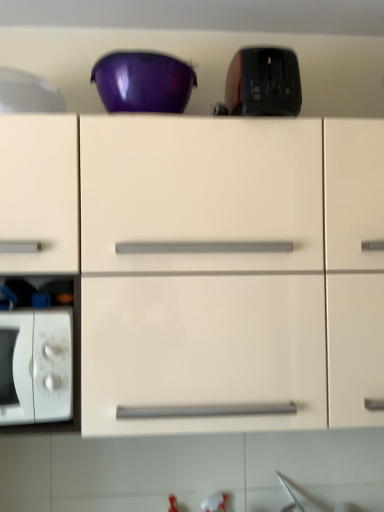
Question: Is glossy plastic bowl at upper center in contact with white matte microwave oven at lower left?

Choices:
 (A) yes
 (B) no

Answer: (B)

Question: From a real-world perspective, does glossy plastic bowl at upper center sit lower than white matte microwave oven at lower left?

Choices:
 (A) no
 (B) yes

Answer: (A)

Question: Does glossy plastic bowl at upper center contain white matte microwave oven at lower left?

Choices:
 (A) no
 (B) yes

Answer: (A)

Question: Can we say glossy plastic bowl at upper center lies outside white matte microwave oven at lower left?

Choices:
 (A) no
 (B) yes

Answer: (B)

Question: Does glossy plastic bowl at upper center appear on the right side of white matte microwave oven at lower left?

Choices:
 (A) no
 (B) yes

Answer: (B)

Question: Are glossy plastic bowl at upper center and white matte microwave oven at lower left far apart?

Choices:
 (A) no
 (B) yes

Answer: (A)

Question: Is white glossy microwave at left, which is the 2th appliance from right to left, facing towards white matte microwave oven at lower left?

Choices:
 (A) no
 (B) yes

Answer: (A)

Question: Is white glossy microwave at left, marked as the first appliance in a left-to-right arrangement, thinner than white matte microwave oven at lower left?

Choices:
 (A) yes
 (B) no

Answer: (A)

Question: Does white glossy microwave at left, marked as the first appliance in a left-to-right arrangement, come in front of white matte microwave oven at lower left?

Choices:
 (A) yes
 (B) no

Answer: (B)

Question: Can you see white glossy microwave at left, which is the 2th appliance from right to left, touching white matte microwave oven at lower left?

Choices:
 (A) no
 (B) yes

Answer: (A)

Question: Is white glossy microwave at left, marked as the first appliance in a left-to-right arrangement, wider than white matte microwave oven at lower left?

Choices:
 (A) yes
 (B) no

Answer: (B)

Question: From the image's perspective, is white glossy microwave at left, which is the 2th appliance from right to left, above white matte microwave oven at lower left?

Choices:
 (A) yes
 (B) no

Answer: (A)

Question: Can you confirm if black glossy toaster at upper center, the second appliance positioned from the left, is wider than matte white cabinet at center?

Choices:
 (A) no
 (B) yes

Answer: (A)